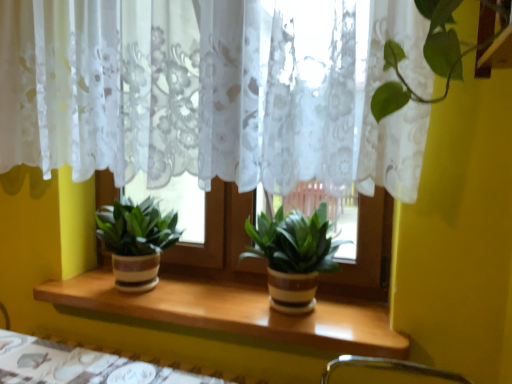
Question: Can you confirm if green matte plant at center, which is the 2th houseplant in left-to-right order, is smaller than white lace curtain at center?

Choices:
 (A) no
 (B) yes

Answer: (B)

Question: Is green matte plant at center, which ranks as the first houseplant in right-to-left order, next to white lace curtain at center and touching it?

Choices:
 (A) no
 (B) yes

Answer: (A)

Question: Is green matte plant at center, which is the 2th houseplant in left-to-right order, not inside white lace curtain at center?

Choices:
 (A) yes
 (B) no

Answer: (A)

Question: From the image's perspective, would you say green matte plant at center, which is the 2th houseplant in left-to-right order, is shown under white lace curtain at center?

Choices:
 (A) yes
 (B) no

Answer: (A)

Question: From a real-world perspective, is green matte plant at center, which ranks as the first houseplant in right-to-left order, positioned over white lace curtain at center based on gravity?

Choices:
 (A) yes
 (B) no

Answer: (B)

Question: From a real-world perspective, is wooden table at lower center above or below green matte plant at center, which ranks as the first houseplant in right-to-left order?

Choices:
 (A) below
 (B) above

Answer: (A)

Question: Looking at the image, does wooden table at lower center seem bigger or smaller compared to green matte plant at center, which ranks as the first houseplant in right-to-left order?

Choices:
 (A) small
 (B) big

Answer: (A)

Question: From their relative heights in the image, would you say wooden table at lower center is taller or shorter than green matte plant at center, which is the 2th houseplant in left-to-right order?

Choices:
 (A) short
 (B) tall

Answer: (A)

Question: Considering the relative positions of wooden table at lower center and green matte plant at center, which ranks as the first houseplant in right-to-left order, in the image provided, is wooden table at lower center to the left or to the right of green matte plant at center, which ranks as the first houseplant in right-to-left order,?

Choices:
 (A) left
 (B) right

Answer: (A)

Question: Considering the positions of point (150, 248) and point (408, 107), is point (150, 248) closer or farther from the camera than point (408, 107)?

Choices:
 (A) farther
 (B) closer

Answer: (A)

Question: Looking at their shapes, would you say green matte plant at center, which is counted as the first houseplant, starting from the left, is wider or thinner than white lace curtain at center?

Choices:
 (A) thin
 (B) wide

Answer: (B)

Question: Is green matte plant at center, the 2th houseplant viewed from the right, inside the boundaries of white lace curtain at center, or outside?

Choices:
 (A) inside
 (B) outside

Answer: (B)

Question: From the image's perspective, is green matte plant at center, the 2th houseplant viewed from the right, positioned above or below white lace curtain at center?

Choices:
 (A) below
 (B) above

Answer: (A)

Question: From the image's perspective, is green matte plant at center, which ranks as the first houseplant in right-to-left order, located above or below wooden at center?

Choices:
 (A) below
 (B) above

Answer: (B)

Question: Is green matte plant at center, which is the 2th houseplant in left-to-right order, inside or outside of wooden at center?

Choices:
 (A) outside
 (B) inside

Answer: (A)